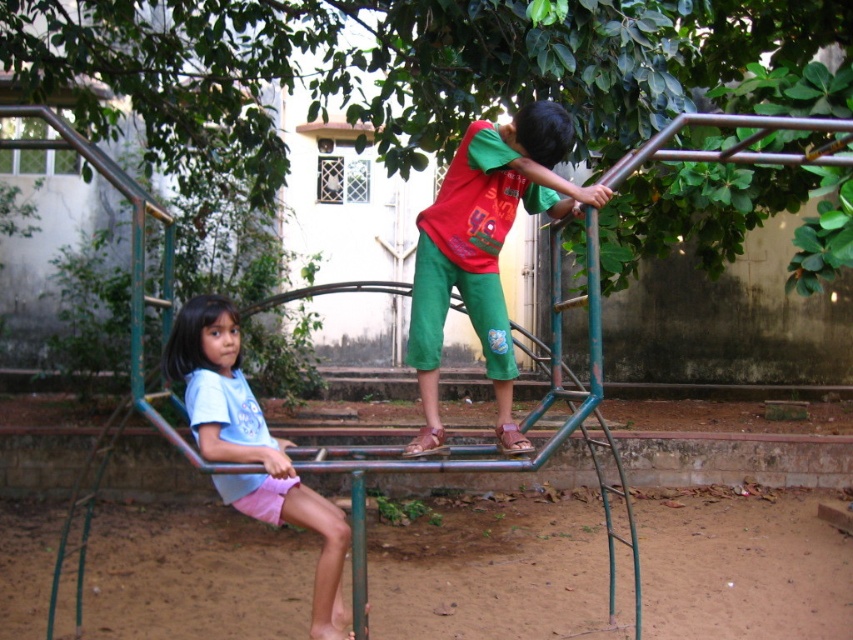
Between green cotton pants at center and light blue fabric shirt at left, which one has more height?

green cotton pants at center

Between point (489, 161) and point (289, 500), which one is positioned behind?

The point (289, 500) is behind.

Is point (502, 394) farther from viewer compared to point (207, 324)?

Yes, it is behind point (207, 324).

The image size is (853, 640). I want to click on green cotton pants at center, so click(x=485, y=250).